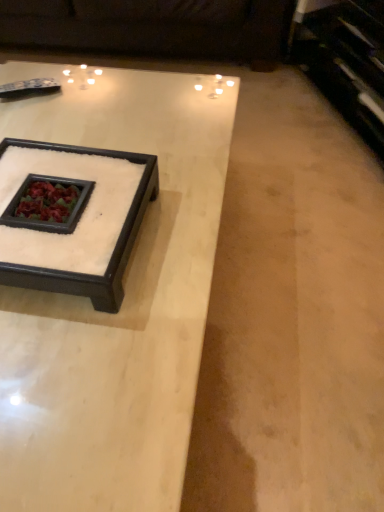
What are the coordinates of `unoccupied space behind white marble tray at center, acting as the second coffee table starting from the front` in the screenshot? It's located at (110, 129).